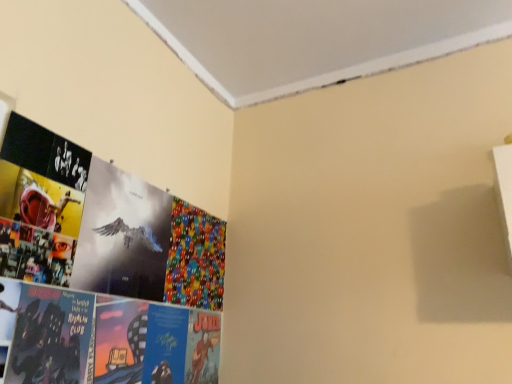
What is the approximate height of multicolored fabric puzzle at center?

multicolored fabric puzzle at center is 14.72 inches tall.

The image size is (512, 384). Identify the location of multicolored fabric puzzle at center. (195, 258).

What do you see at coordinates (195, 258) in the screenshot? I see `multicolored fabric puzzle at center` at bounding box center [195, 258].

You are a GUI agent. You are given a task and a screenshot of the screen. Output one action in this format:
    pyautogui.click(x=<x>, y=<y>)
    Task: Click on the multicolored fabric puzzle at center
    
    Given the screenshot: What is the action you would take?
    pyautogui.click(x=195, y=258)